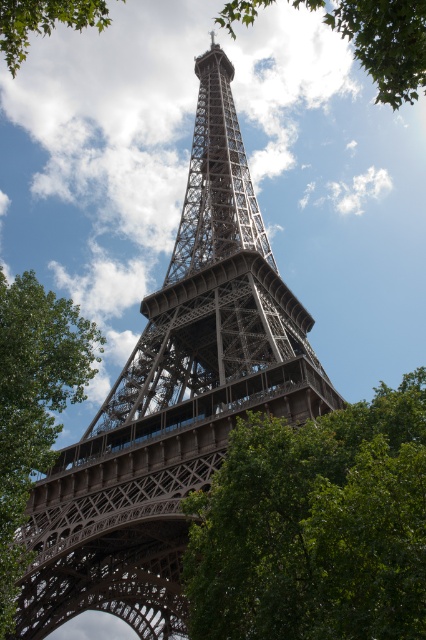
Is point (255, 561) farther from camera compared to point (5, 52)?

No.

Can you confirm if green leafy tree at lower center is positioned above green leafy tree at upper left?

No, green leafy tree at lower center is not above green leafy tree at upper left.

Image resolution: width=426 pixels, height=640 pixels. I want to click on green leafy tree at lower center, so click(314, 525).

Does green leafy tree at lower center have a greater width compared to green leafy tree at left?

Incorrect, green leafy tree at lower center's width does not surpass green leafy tree at left's.

Does green leafy tree at lower center have a larger size compared to green leafy tree at left?

Incorrect, green leafy tree at lower center is not larger than green leafy tree at left.

What do you see at coordinates (314, 525) in the screenshot? The width and height of the screenshot is (426, 640). I see `green leafy tree at lower center` at bounding box center [314, 525].

Find the location of a particular element. green leafy tree at lower center is located at coordinates (314, 525).

Is green leafy tree at upper center positioned behind green leafy tree at upper left?

No, green leafy tree at upper center is in front of green leafy tree at upper left.

At what (x,y) coordinates should I click in order to perform the action: click on green leafy tree at upper center. Please return your answer as a coordinate pair (x, y). Looking at the image, I should click on (385, 42).